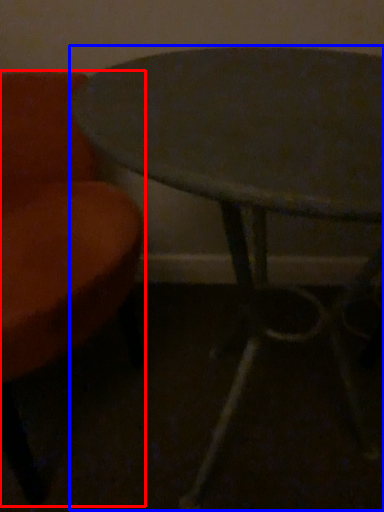
Question: Which point is further to the camera, chair (highlighted by a red box) or table (highlighted by a blue box)?

Choices:
 (A) chair
 (B) table

Answer: (B)